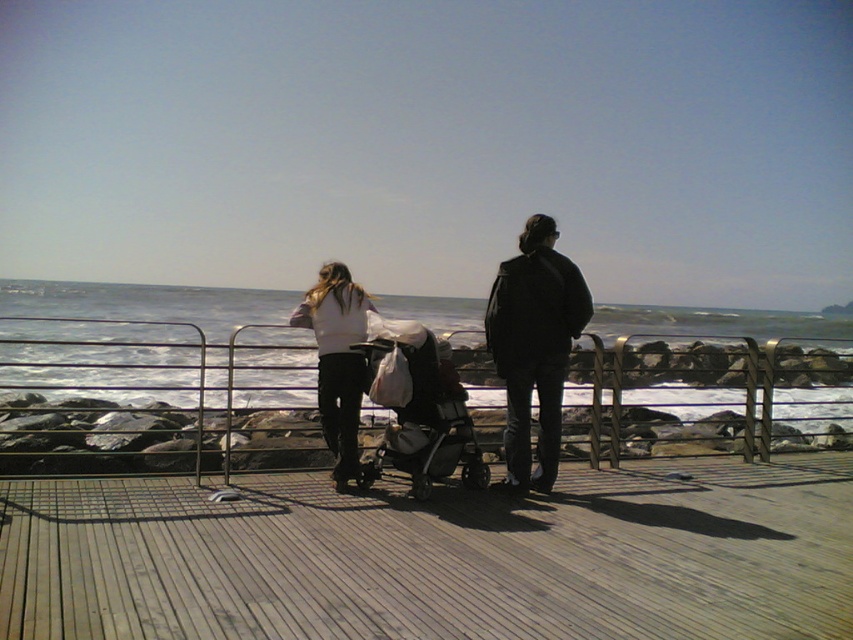
Question: Where is wooden at center located in relation to black fabric stroller at center in the image?

Choices:
 (A) right
 (B) left

Answer: (A)

Question: Is blue water at center wider than black leather jacket at center?

Choices:
 (A) no
 (B) yes

Answer: (B)

Question: Is blue water at center to the left of black leather jacket at center from the viewer's perspective?

Choices:
 (A) yes
 (B) no

Answer: (A)

Question: Which of these objects is positioned closest to the wooden at center?

Choices:
 (A) black fabric stroller at center
 (B) blue water at center
 (C) white matte shirt at center
 (D) black leather jacket at center

Answer: (A)

Question: Based on their relative distances, which object is farther from the wooden at center?

Choices:
 (A) white matte shirt at center
 (B) blue water at center
 (C) black leather jacket at center

Answer: (B)

Question: Considering the real-world distances, which object is farthest from the blue water at center?

Choices:
 (A) black leather jacket at center
 (B) black fabric stroller at center

Answer: (A)